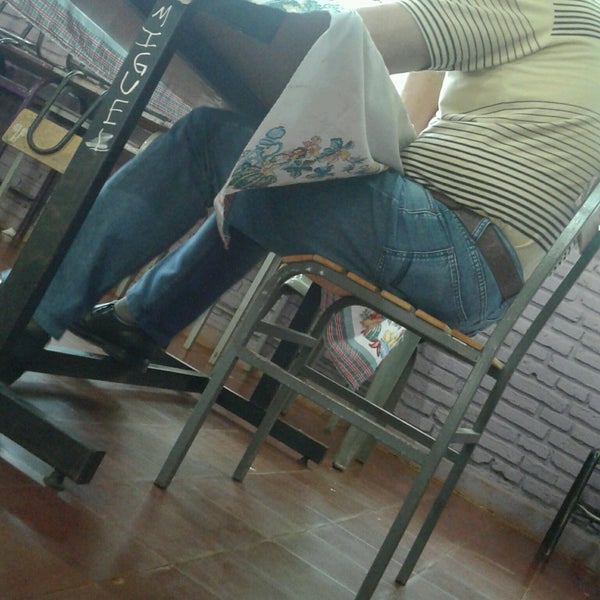
At what (x,y) coordinates should I click in order to perform the action: click on metal chair. Please return your answer as a coordinate pair (x, y). This screenshot has width=600, height=600. Looking at the image, I should click on (383, 417).